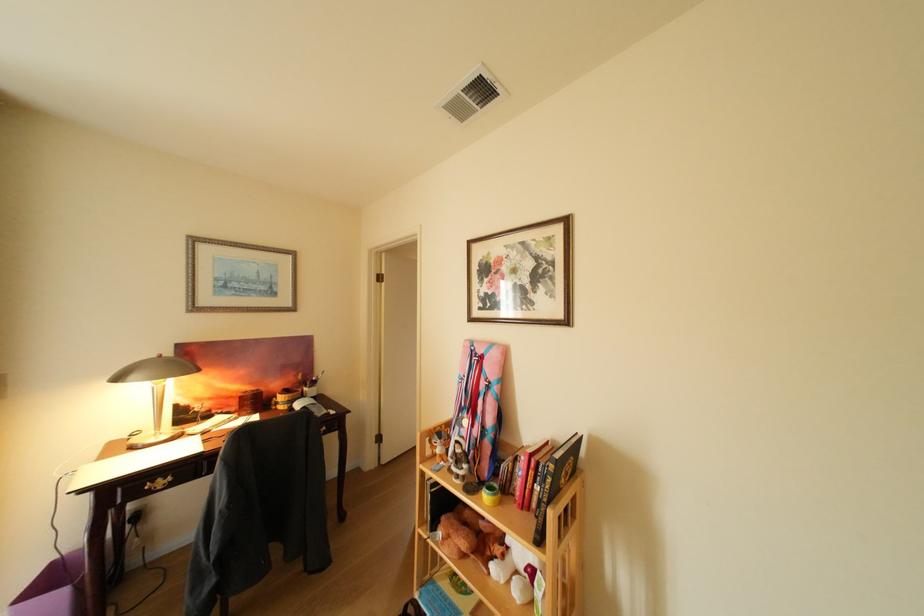
Find where to adjust the lamp head. Please return your answer as a coordinate pair (x, y).

(153, 370)